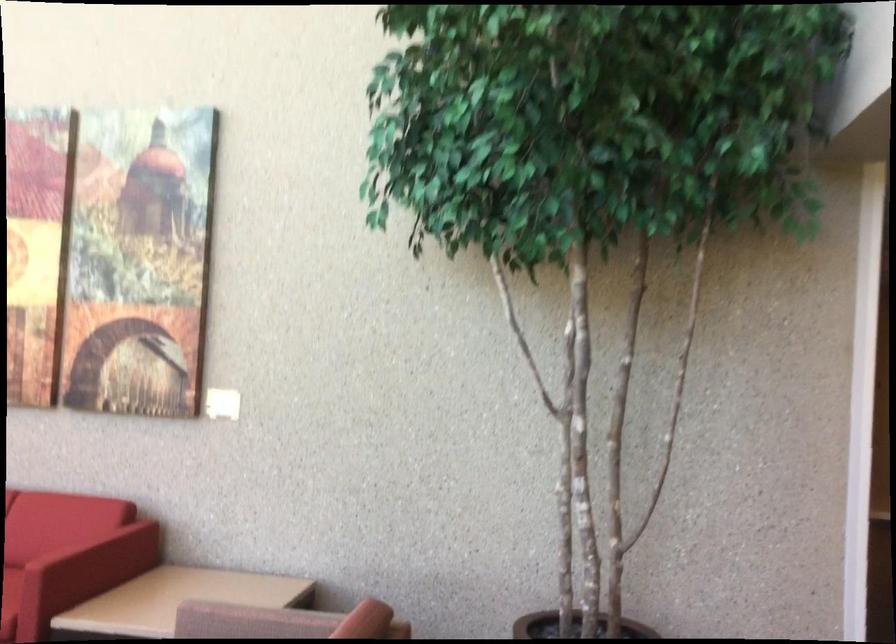
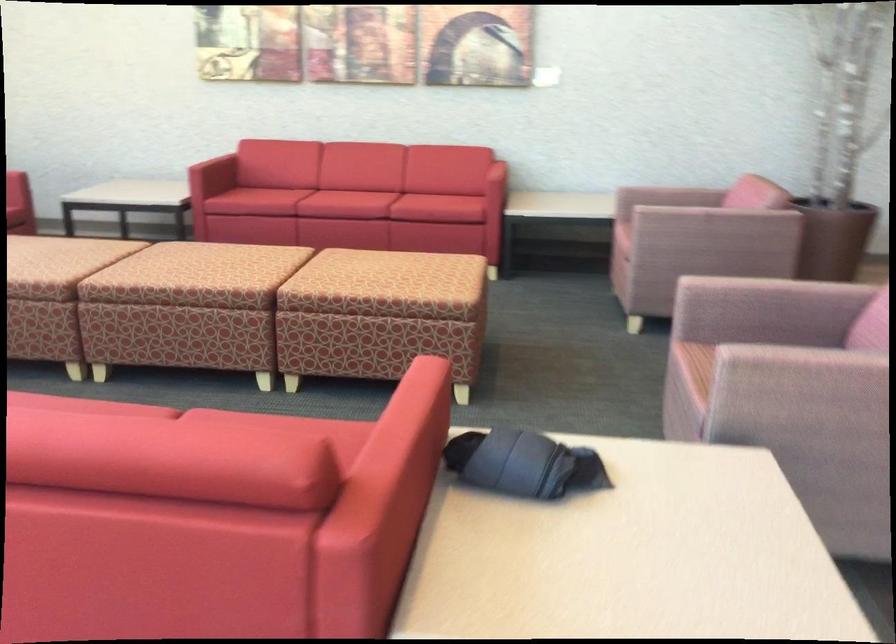
The images are taken continuously from a first-person perspective. In which direction are you moving?

The movement direction of the cameraman is left, backward.